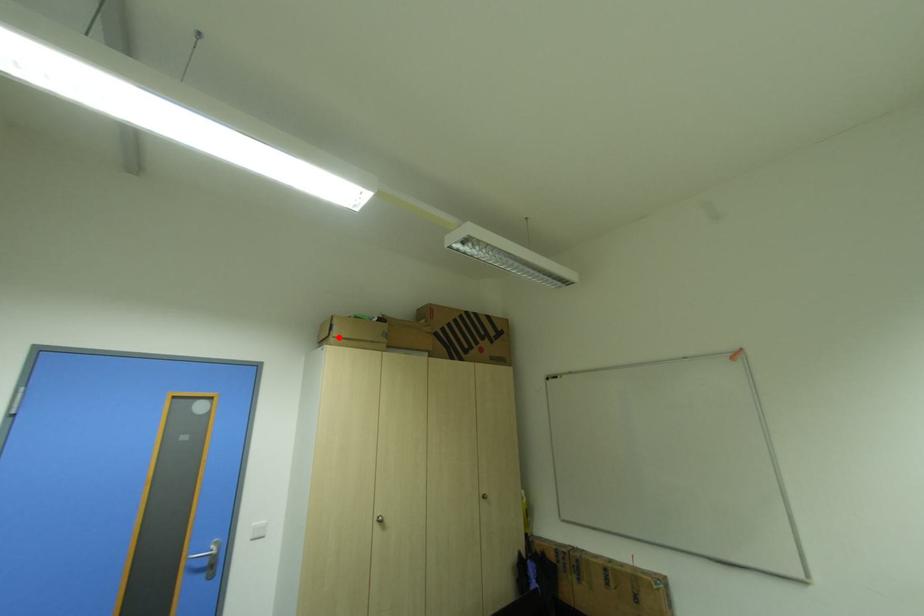
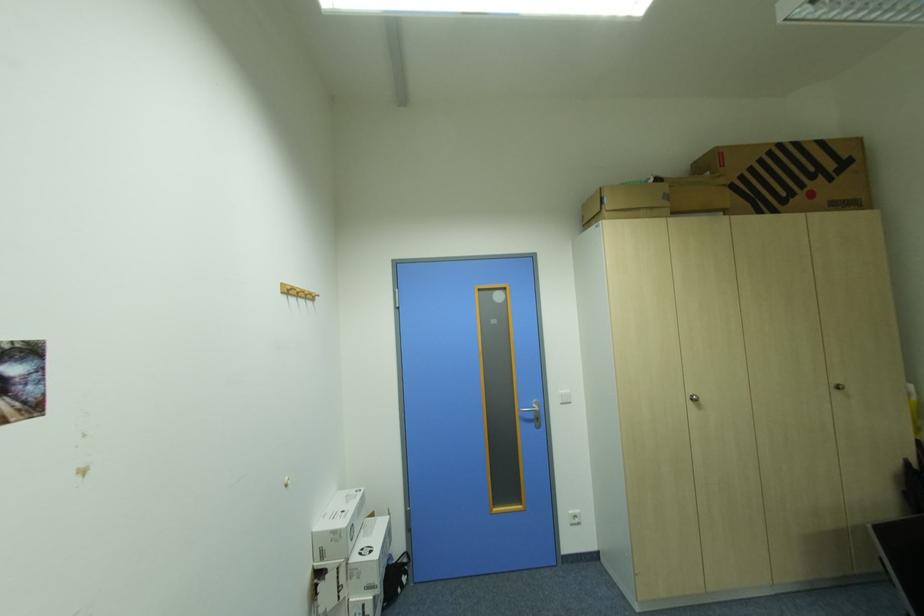
Locate, in the second image, the point that corresponds to the highlighted location in the first image.

(612, 211)